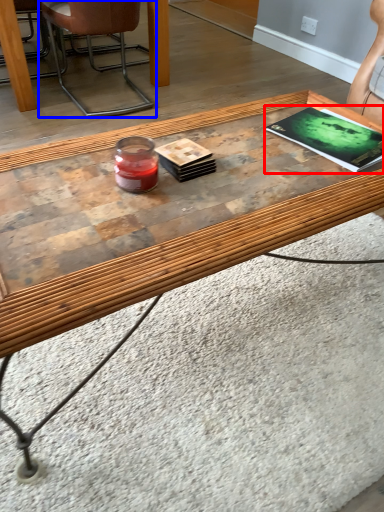
Question: Which of the following is the farthest to the observer, magazine (highlighted by a red box) or chair (highlighted by a blue box)?

Choices:
 (A) magazine
 (B) chair

Answer: (B)